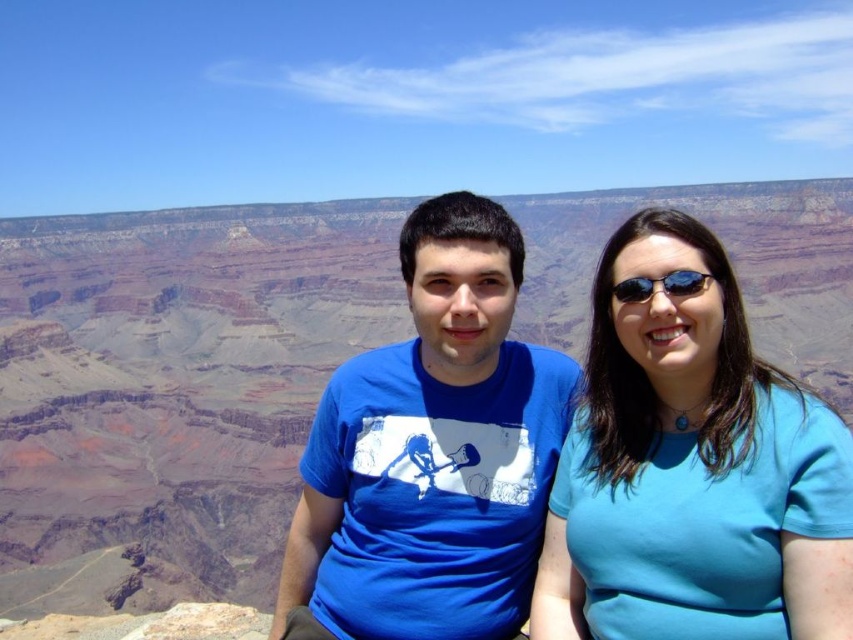
Question: Does reddish-brown rock formation at center have a lesser width compared to blue cotton t-shirt at center?

Choices:
 (A) yes
 (B) no

Answer: (B)

Question: Which of the following is the closest to the observer?

Choices:
 (A) (141, 392)
 (B) (461, 433)

Answer: (B)

Question: Does blue fabric shirt at center lie in front of blue cotton t-shirt at center?

Choices:
 (A) no
 (B) yes

Answer: (B)

Question: Which point is closer to the camera?

Choices:
 (A) (x=543, y=348)
 (B) (x=674, y=275)
 (C) (x=544, y=634)
 (D) (x=320, y=323)

Answer: (C)

Question: Is reddish-brown rock formation at center further to camera compared to blue cotton t-shirt at center?

Choices:
 (A) no
 (B) yes

Answer: (B)

Question: Which point is closer to the camera taking this photo?

Choices:
 (A) (343, 291)
 (B) (700, 515)

Answer: (B)